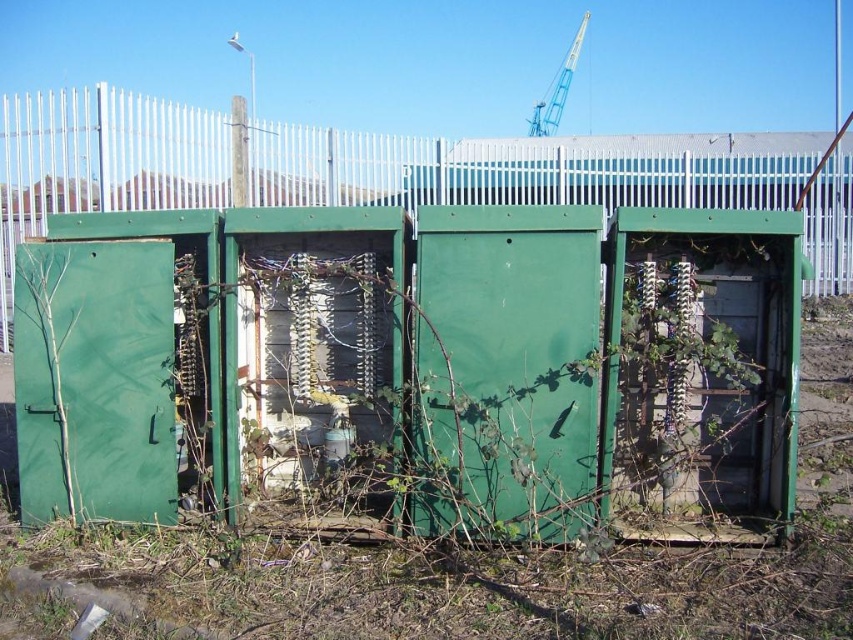
Is the position of green painted metal fence at center more distant than that of yellow metallic crane at upper center?

No, green painted metal fence at center is in front of yellow metallic crane at upper center.

In the scene shown: Which is below, green painted metal fence at center or yellow metallic crane at upper center?

green painted metal fence at center is lower down.

Between point (811, 278) and point (537, 100), which one is positioned in front?

Point (811, 278) is in front.

At what (x,y) coordinates should I click in order to perform the action: click on green painted metal fence at center. Please return your answer as a coordinate pair (x, y). Image resolution: width=853 pixels, height=640 pixels. Looking at the image, I should click on pos(527,168).